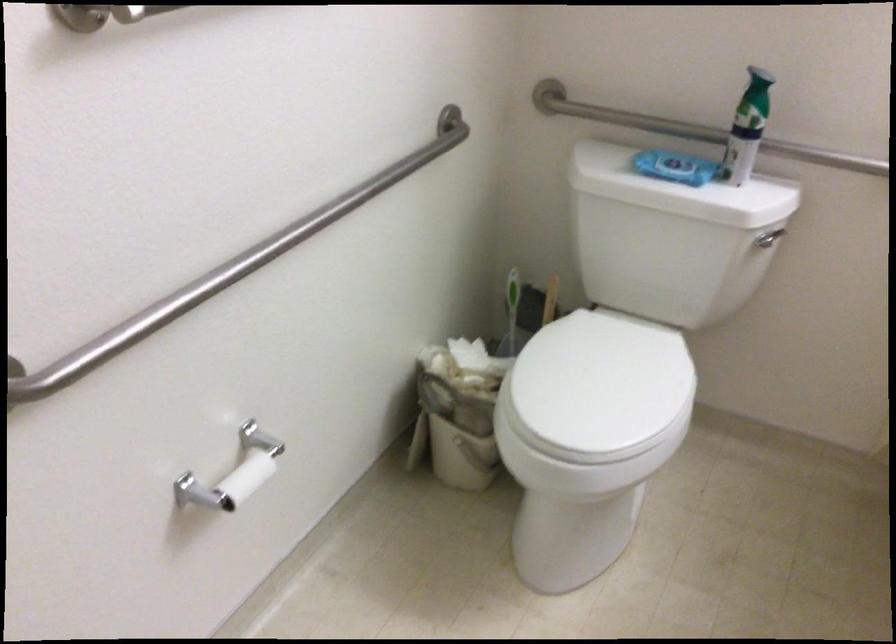
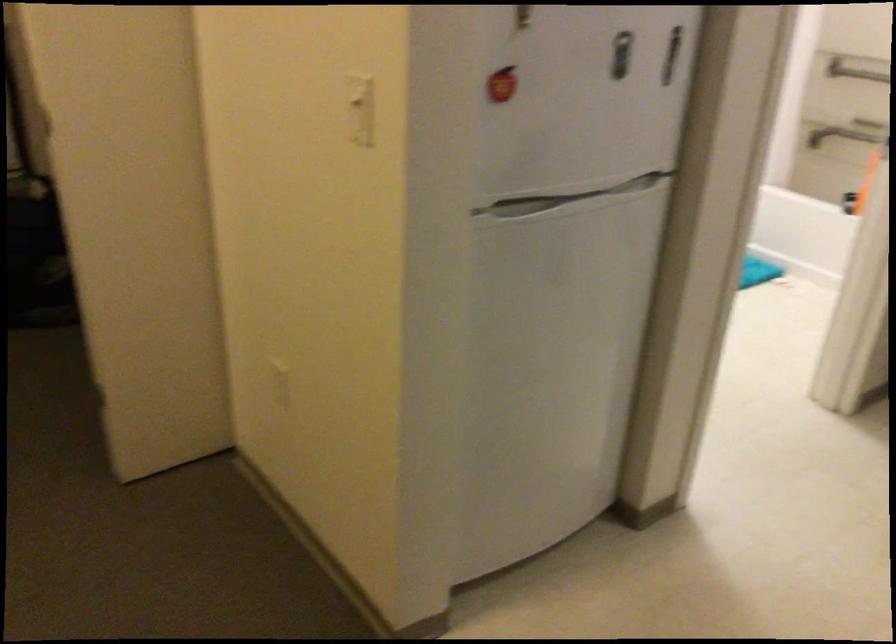
Question: I am providing you with two images of the same scene from different viewpoints. Please identify which objects are invisible in image2.

Choices:
 (A) white oval magnet
 (B) red apple magnet
 (C) metal grab bar
 (D) toilet paper roll

Answer: (D)